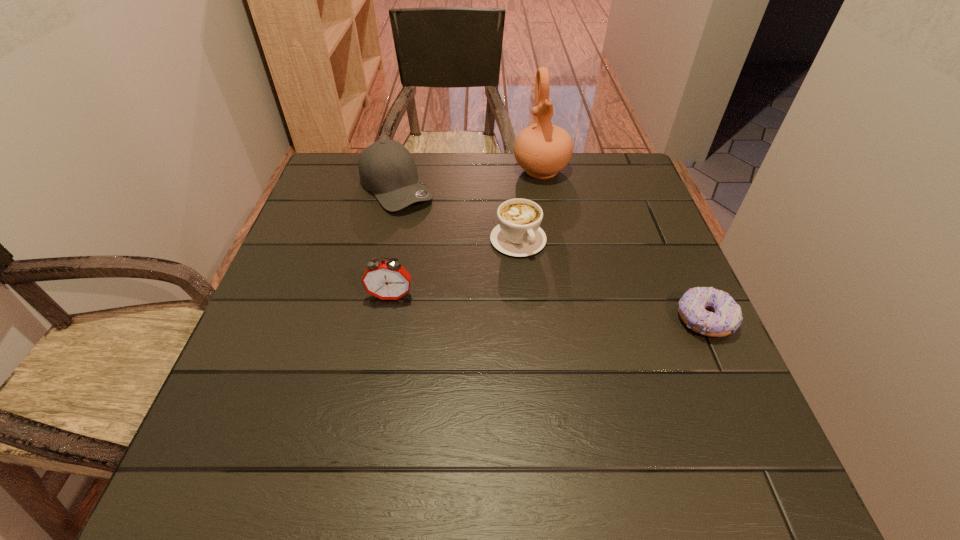
Find the location of a particular element. alarm clock is located at coordinates (387, 280).

This screenshot has height=540, width=960. I want to click on the rightmost object, so click(725, 317).

In order to click on doughnut in this screenshot , I will do `click(725, 317)`.

The width and height of the screenshot is (960, 540). I want to click on the third nearest object, so click(x=518, y=233).

Where is `cappuccino`? The image size is (960, 540). cappuccino is located at coordinates (518, 233).

You are a GUI agent. You are given a task and a screenshot of the screen. Output one action in this format:
    pyautogui.click(x=<x>, y=<y>)
    Task: Click on the pottery
    This screenshot has height=540, width=960.
    Given the screenshot: What is the action you would take?
    pyautogui.click(x=542, y=150)

I want to click on baseball cap, so click(387, 169).

At what (x,y) coordinates should I click in order to perform the action: click on free space located on the clock face of the alarm clock. Please return your answer as a coordinate pair (x, y). The width and height of the screenshot is (960, 540). Looking at the image, I should click on (370, 410).

This screenshot has height=540, width=960. Find the location of `vacant space situated on the back of the rightmost object`. vacant space situated on the back of the rightmost object is located at coordinates (660, 219).

You are a GUI agent. You are given a task and a screenshot of the screen. Output one action in this format:
    pyautogui.click(x=<x>, y=<y>)
    Task: Click on the free space located to the right of the second shortest object's handle
    Image resolution: width=960 pixels, height=540 pixels.
    Given the screenshot: What is the action you would take?
    pyautogui.click(x=640, y=396)